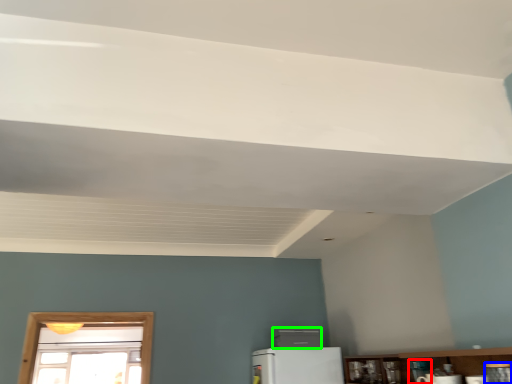
Question: Which object is the farthest from appliance (highlighted by a red box)? Choose among these: appliance (highlighted by a blue box) or appliance (highlighted by a green box).

Choices:
 (A) appliance
 (B) appliance

Answer: (B)